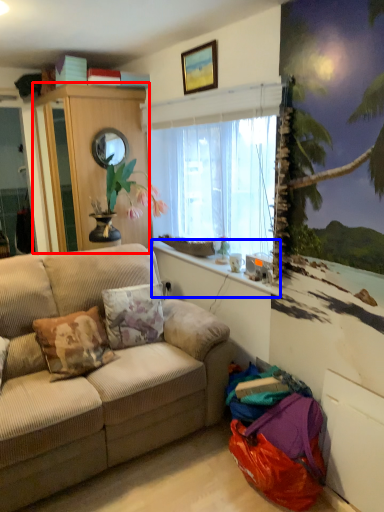
Question: Which object is closer to the camera taking this photo, cabinetry (highlighted by a red box) or window sill (highlighted by a blue box)?

Choices:
 (A) cabinetry
 (B) window sill

Answer: (B)